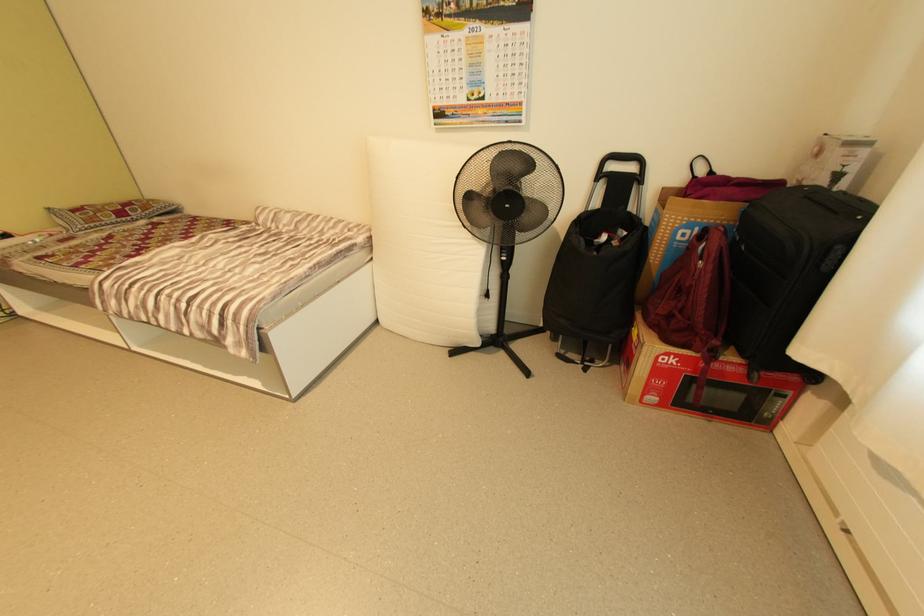
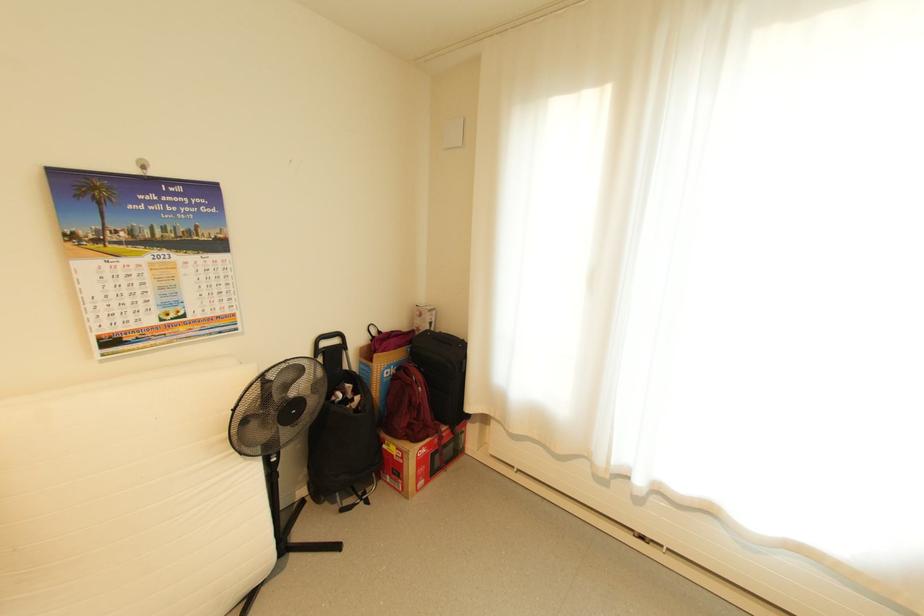
Where in the second image is the point corresponding to point 702,229 from the first image?

(398, 368)